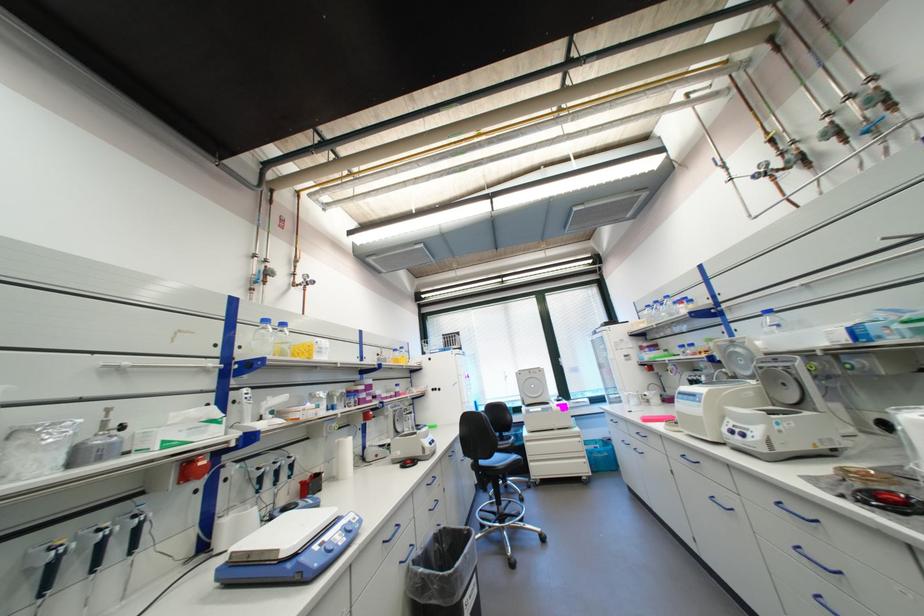
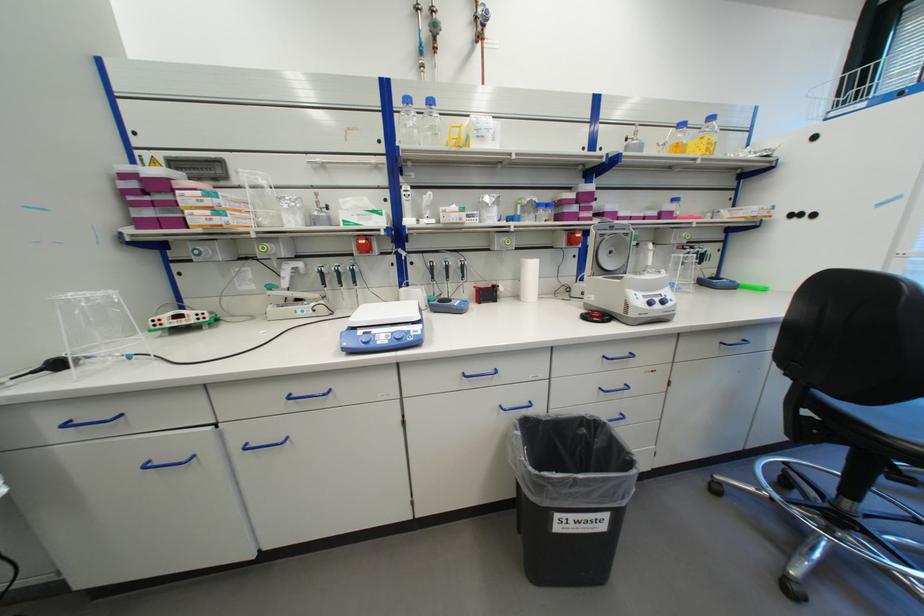
Where in the second image is the point corresponding to (407,430) from the first image?

(616, 267)